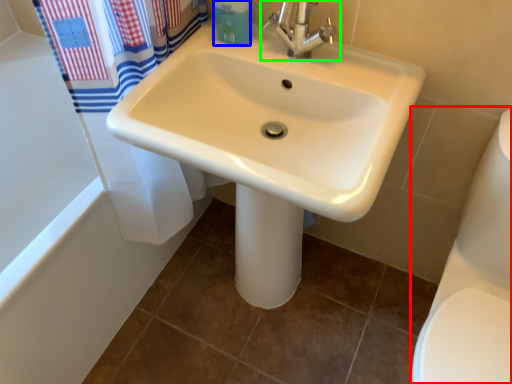
Question: Considering the real-world distances, which object is closest to toilet bowl (highlighted by a red box)? toiletry (highlighted by a blue box) or tap (highlighted by a green box).

Choices:
 (A) toiletry
 (B) tap

Answer: (B)